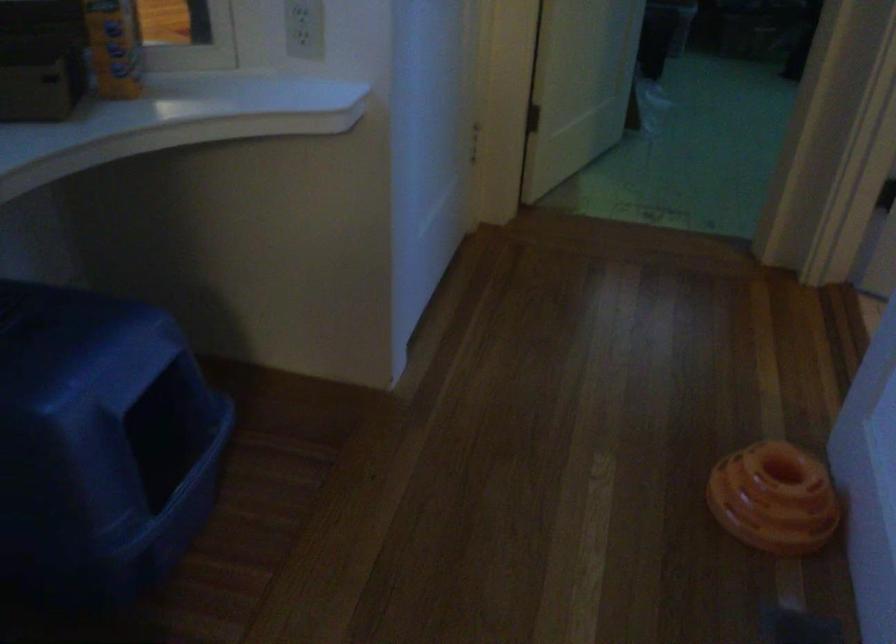
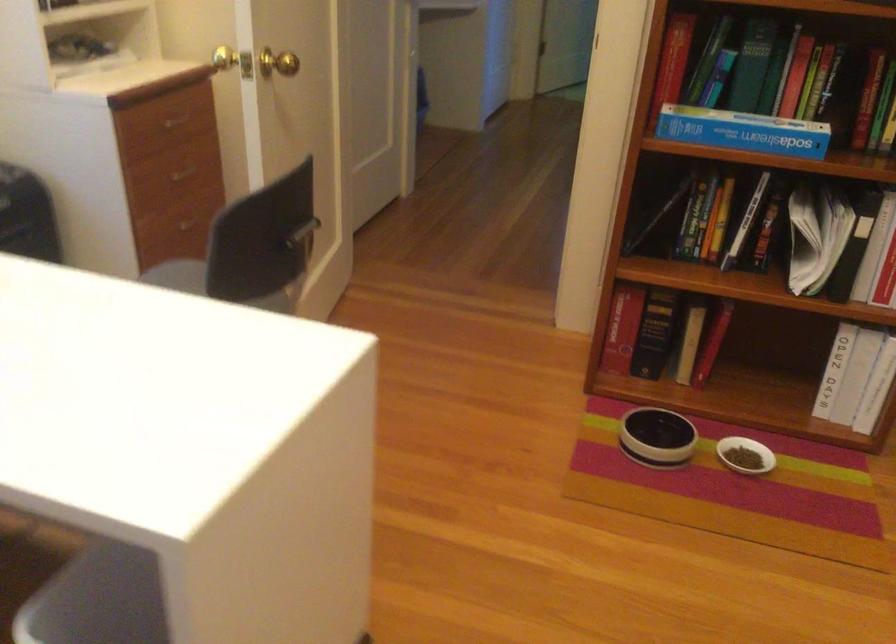
Question: I am providing you with two images of the same scene from different viewpoints. Please identify which objects are invisible in image2.

Choices:
 (A) litter box cover
 (B) brass door knob
 (C) rice cooker handle
 (D) small white bowl

Answer: (A)